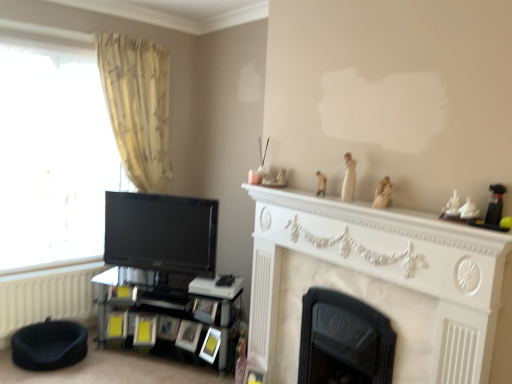
Question: From a real-world perspective, does black cast iron fireplace at center, placed as the 2th fireplace when sorted from front to back, sit lower than dark blue fabric bean bag chair at lower left?

Choices:
 (A) no
 (B) yes

Answer: (A)

Question: Can you confirm if black cast iron fireplace at center, the first fireplace viewed from the back, is positioned to the left of dark blue fabric bean bag chair at lower left?

Choices:
 (A) no
 (B) yes

Answer: (A)

Question: Does black cast iron fireplace at center, placed as the 2th fireplace when sorted from front to back, have a greater height compared to dark blue fabric bean bag chair at lower left?

Choices:
 (A) no
 (B) yes

Answer: (B)

Question: Does black cast iron fireplace at center, placed as the 2th fireplace when sorted from front to back, lie in front of dark blue fabric bean bag chair at lower left?

Choices:
 (A) yes
 (B) no

Answer: (A)

Question: Does black cast iron fireplace at center, placed as the 2th fireplace when sorted from front to back, have a smaller size compared to dark blue fabric bean bag chair at lower left?

Choices:
 (A) yes
 (B) no

Answer: (B)

Question: Can you confirm if black cast iron fireplace at center, the first fireplace viewed from the back, is shorter than dark blue fabric bean bag chair at lower left?

Choices:
 (A) yes
 (B) no

Answer: (B)

Question: Does black glossy shelf at lower left appear on the right side of white porcelain figurine at upper right?

Choices:
 (A) no
 (B) yes

Answer: (A)

Question: Is black glossy shelf at lower left turned away from white porcelain figurine at upper right?

Choices:
 (A) no
 (B) yes

Answer: (A)

Question: Would you say black glossy shelf at lower left contains white porcelain figurine at upper right?

Choices:
 (A) yes
 (B) no

Answer: (B)

Question: Does black glossy shelf at lower left have a smaller size compared to white porcelain figurine at upper right?

Choices:
 (A) yes
 (B) no

Answer: (B)

Question: Is black glossy shelf at lower left taller than white porcelain figurine at upper right?

Choices:
 (A) yes
 (B) no

Answer: (A)

Question: Does black glossy shelf at lower left turn towards white porcelain figurine at upper right?

Choices:
 (A) no
 (B) yes

Answer: (A)

Question: From a real-world perspective, is white textured radiator at lower left on top of black glossy tv at left?

Choices:
 (A) yes
 (B) no

Answer: (B)